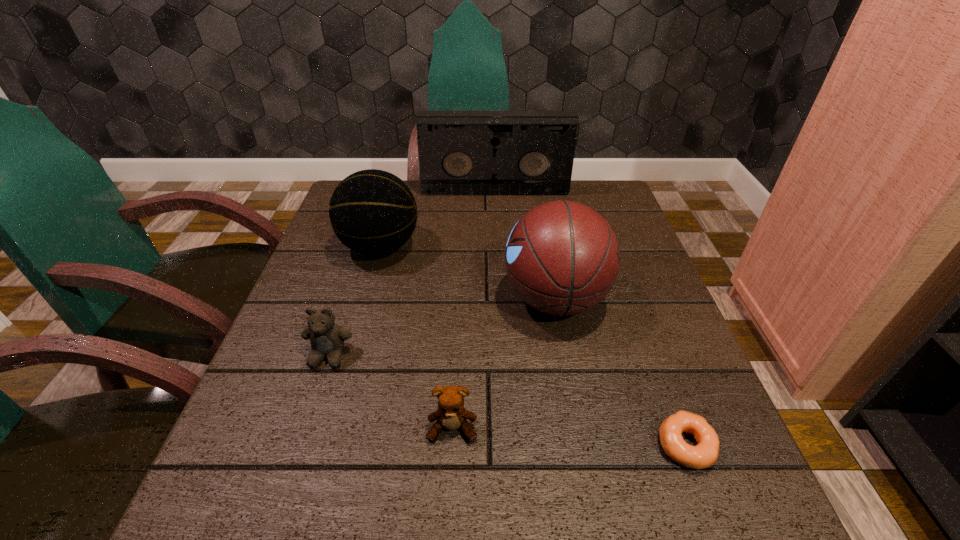
Locate an element on the screen. The height and width of the screenshot is (540, 960). vacant area in the image that satisfies the following two spatial constraints: 1. on the front side of the doughnut; 2. on the left side of the farthest object is located at coordinates (508, 446).

Find the location of a particular element. vacant space that satisfies the following two spatial constraints: 1. on the front-facing side of the shorter teddy bear; 2. on the right side of the shortest object is located at coordinates (451, 446).

Locate an element on the screen. This screenshot has width=960, height=540. blank area in the image that satisfies the following two spatial constraints: 1. on the front side of the farthest object; 2. on the left side of the shortest object is located at coordinates (508, 446).

Find the location of a particular element. Image resolution: width=960 pixels, height=540 pixels. free space that satisfies the following two spatial constraints: 1. on the front-facing side of the nearer teddy bear; 2. on the right side of the shortest object is located at coordinates (451, 446).

Locate an element on the screen. The height and width of the screenshot is (540, 960). free space in the image that satisfies the following two spatial constraints: 1. on the front side of the right basketball; 2. on the right side of the videotape is located at coordinates (500, 299).